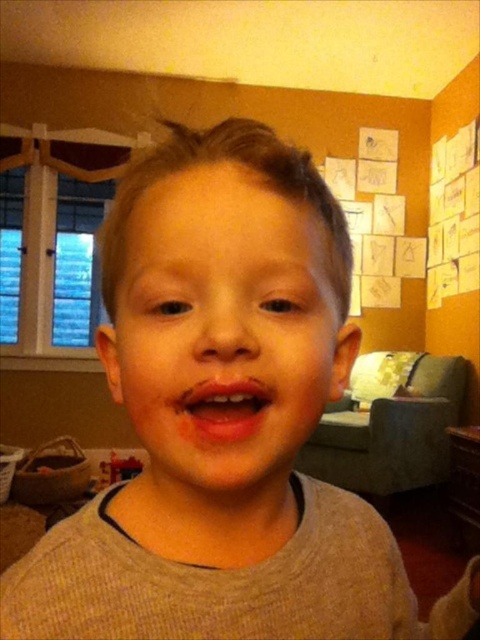
Based on the scene description, can you determine if the smooth skin face at center is closer to the camera than the bright red lips at center?

The smooth skin face at center is in front of bright red lips at center, so yes, the smooth skin face at center is closer to the camera than the bright red lips at center.

Looking at this image, looking at the child in the light gray sweater, can you tell if the smooth skin face at center is bigger than the bright red lips at center?

Yes, the smooth skin face at center is larger in size compared to the bright red lips at center.

You are standing in the living room and want to reach a point that is 11.14 inches away from you. Can you confirm if the point at coordinates point (320, 253) is exactly at that distance?

The distance of point (320, 253) from viewer is 11.14 inches, so yes, the point at coordinates point (320, 253) is exactly 11.14 inches away from you.